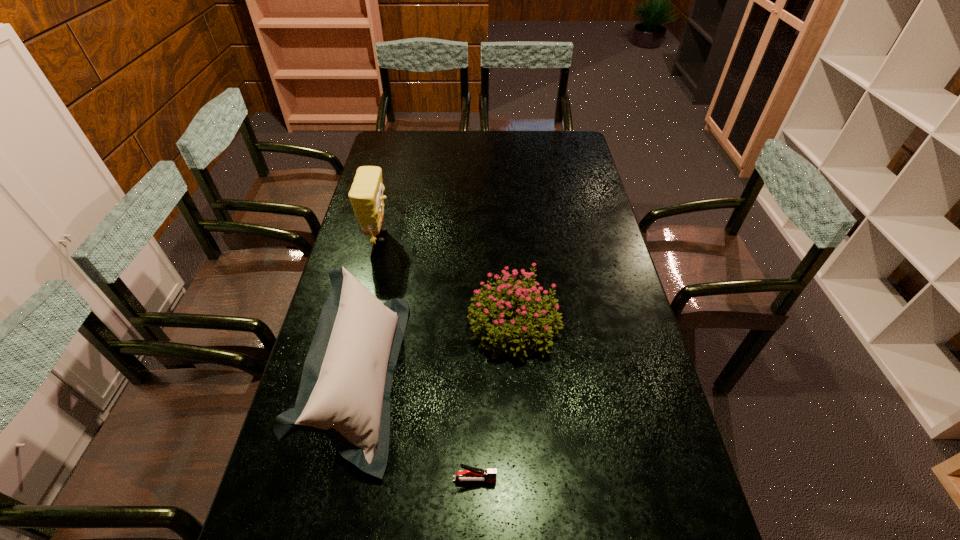
Where is `free space between the cushion and the bouquet`? The image size is (960, 540). free space between the cushion and the bouquet is located at coordinates (438, 352).

You are a GUI agent. You are given a task and a screenshot of the screen. Output one action in this format:
    pyautogui.click(x=<x>, y=<y>)
    Task: Click on the vacant space that is in between the cushion and the stapler
    This screenshot has height=540, width=960.
    Given the screenshot: What is the action you would take?
    pyautogui.click(x=418, y=429)

Where is `the third closest object to the shortest object`? the third closest object to the shortest object is located at coordinates (366, 195).

What are the coordinates of `the third closest object relative to the stapler` in the screenshot? It's located at (366, 195).

Find the location of `free point that satisfies the following two spatial constraints: 1. on the front side of the bouquet; 2. on the handle side of the shortest object`. free point that satisfies the following two spatial constraints: 1. on the front side of the bouquet; 2. on the handle side of the shortest object is located at coordinates (525, 480).

The width and height of the screenshot is (960, 540). In order to click on free spot that satisfies the following two spatial constraints: 1. on the front side of the bouquet; 2. on the handle side of the shortest object in this screenshot , I will do `click(525, 480)`.

This screenshot has width=960, height=540. I want to click on vacant space that satisfies the following two spatial constraints: 1. on the face of the bouquet; 2. on the right side of the sponge, so click(x=358, y=326).

Image resolution: width=960 pixels, height=540 pixels. Find the location of `vacant space that satisfies the following two spatial constraints: 1. on the face of the farthest object; 2. on the back side of the bouquet`. vacant space that satisfies the following two spatial constraints: 1. on the face of the farthest object; 2. on the back side of the bouquet is located at coordinates 358,326.

Locate an element on the screen. This screenshot has width=960, height=540. free space that satisfies the following two spatial constraints: 1. on the front side of the bouquet; 2. on the handle side of the stapler is located at coordinates (525, 480).

You are a GUI agent. You are given a task and a screenshot of the screen. Output one action in this format:
    pyautogui.click(x=<x>, y=<y>)
    Task: Click on the free space that satisfies the following two spatial constraints: 1. on the front side of the bouquet; 2. on the surface of the cushion
    The image size is (960, 540).
    Given the screenshot: What is the action you would take?
    pos(517,379)